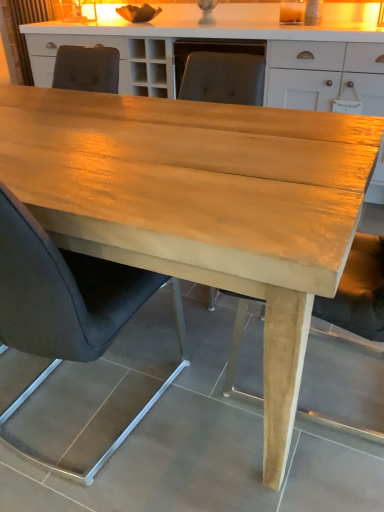
Question: Is matte gray chair at center, the 2th chair when ordered from front to back, facing towards matte brown curtain at upper left?

Choices:
 (A) yes
 (B) no

Answer: (B)

Question: Is matte gray chair at center, the 2th chair when ordered from front to back, looking in the opposite direction of matte brown curtain at upper left?

Choices:
 (A) yes
 (B) no

Answer: (B)

Question: From the image's perspective, is matte gray chair at center, the 2th chair when ordered from front to back, located above matte brown curtain at upper left?

Choices:
 (A) yes
 (B) no

Answer: (B)

Question: Is matte gray chair at center, the first chair viewed from the back, positioned far away from matte brown curtain at upper left?

Choices:
 (A) no
 (B) yes

Answer: (B)

Question: Is matte gray chair at center, the first chair viewed from the back, next to matte brown curtain at upper left?

Choices:
 (A) yes
 (B) no

Answer: (B)

Question: Is matte gray chair at center, the first chair viewed from the back, smaller than matte brown curtain at upper left?

Choices:
 (A) no
 (B) yes

Answer: (A)

Question: From the image's perspective, is matte brown curtain at upper left under black leather chair at center, marked as the first chair in a front-to-back arrangement?

Choices:
 (A) yes
 (B) no

Answer: (B)

Question: Is matte brown curtain at upper left turned away from black leather chair at center, marked as the first chair in a front-to-back arrangement?

Choices:
 (A) no
 (B) yes

Answer: (A)

Question: From a real-world perspective, does matte brown curtain at upper left sit lower than black leather chair at center, marked as the first chair in a front-to-back arrangement?

Choices:
 (A) yes
 (B) no

Answer: (B)

Question: From the image's perspective, is matte brown curtain at upper left on top of black leather chair at center, marked as the first chair in a front-to-back arrangement?

Choices:
 (A) yes
 (B) no

Answer: (A)

Question: Does matte brown curtain at upper left come behind black leather chair at center, marked as the first chair in a front-to-back arrangement?

Choices:
 (A) no
 (B) yes

Answer: (B)

Question: Does matte brown curtain at upper left have a smaller size compared to black leather chair at center, marked as the first chair in a front-to-back arrangement?

Choices:
 (A) yes
 (B) no

Answer: (A)

Question: From a real-world perspective, is black leather chair at center, marked as the first chair in a front-to-back arrangement, physically below matte gray chair at center, the 2th chair when ordered from front to back?

Choices:
 (A) yes
 (B) no

Answer: (A)